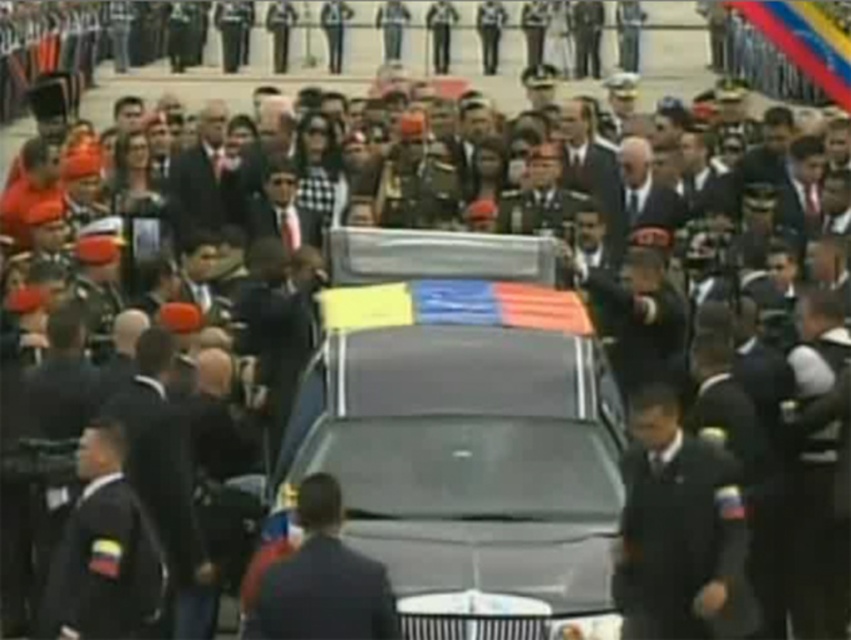
In the scene shown: You are standing at the point marked as point (680, 529) in the image. Looking around, you see a dark blue uniform at center. What is the closest object to your current position?

The point (680, 529) is on the dark blue uniform at center, so the closest object to your current position is the dark blue uniform at center.

You are a photographer at the event and need to capture a closeup of the dark blue uniform at center without including the hearse. Based on its position, can you position yourself to the left or right side of the uniform to avoid the hearse?

The dark blue uniform at center is located at point (680, 529), so positioning yourself to the right side of the uniform would avoid the hearse.